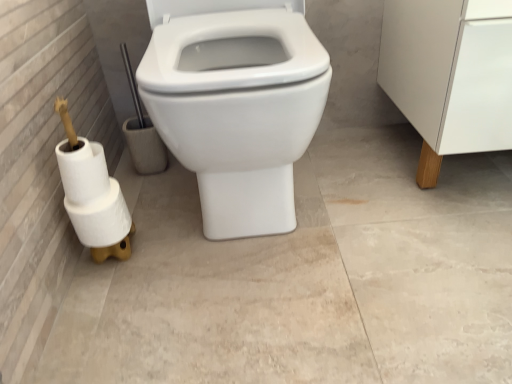
You are a GUI agent. You are given a task and a screenshot of the screen. Output one action in this format:
    pyautogui.click(x=<x>, y=<y>)
    Task: Click on the vacant space to the right of white matte toilet paper at left, which ranks as the second toilet paper in bottom-to-top order
    The width and height of the screenshot is (512, 384).
    Given the screenshot: What is the action you would take?
    pyautogui.click(x=178, y=259)